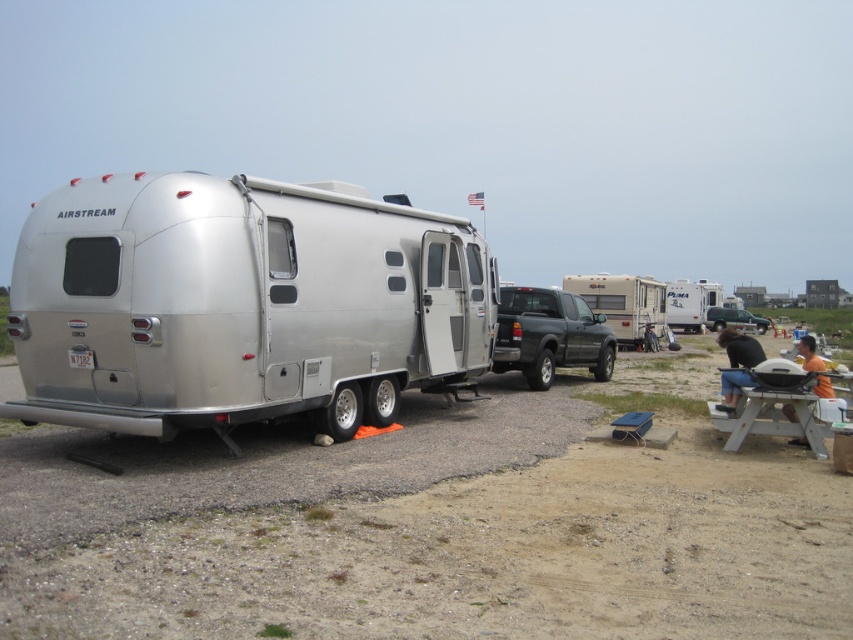
Question: Considering the real-world distances, which object is farthest from the beige plastic camper at center?

Choices:
 (A) matte black truck at center
 (B) metallic silver suv at center
 (C) jeans at lower right
 (D) white plastic picnic table at lower right

Answer: (B)

Question: Which of the following is the farthest from the observer?

Choices:
 (A) (727, 397)
 (B) (654, 296)

Answer: (B)

Question: Where is white plastic picnic table at lower right located in relation to orange fabric shirt at lower right in the image?

Choices:
 (A) below
 (B) above

Answer: (A)

Question: From the image, what is the correct spatial relationship of dirt field at lower center in relation to white plastic picnic table at lower right?

Choices:
 (A) left
 (B) right

Answer: (A)

Question: Which point is closer to the camera taking this photo?

Choices:
 (A) (730, 403)
 (B) (693, 314)
 (C) (73, 333)

Answer: (C)

Question: Can you confirm if white plastic picnic table at lower right is smaller than metallic silver suv at center?

Choices:
 (A) no
 (B) yes

Answer: (A)